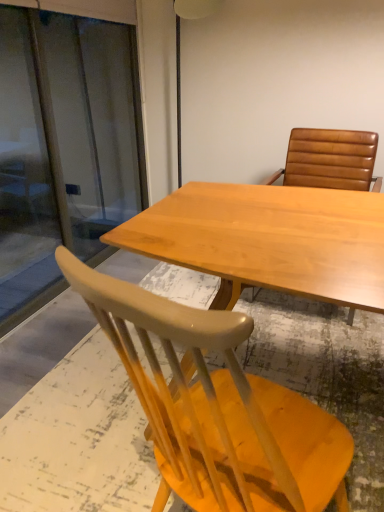
Question: Is brown leather chair at upper right, acting as the 1th chair starting from the top, wider than transparent glass screen door at left?

Choices:
 (A) no
 (B) yes

Answer: (B)

Question: Is brown leather chair at upper right, acting as the 1th chair starting from the top, oriented towards transparent glass screen door at left?

Choices:
 (A) no
 (B) yes

Answer: (A)

Question: From the image's perspective, does brown leather chair at upper right, acting as the 1th chair starting from the top, appear lower than transparent glass screen door at left?

Choices:
 (A) no
 (B) yes

Answer: (B)

Question: From the image's perspective, is brown leather chair at upper right, the second chair from the bottom, over transparent glass screen door at left?

Choices:
 (A) no
 (B) yes

Answer: (A)

Question: Would you say matte yellow chair at lower left, the 2th chair when ordered from top to bottom, is inside or outside transparent glass screen door at left?

Choices:
 (A) outside
 (B) inside

Answer: (A)

Question: Visually, is matte yellow chair at lower left, acting as the first chair starting from the bottom, positioned to the left or to the right of transparent glass screen door at left?

Choices:
 (A) left
 (B) right

Answer: (B)

Question: Is matte yellow chair at lower left, the 2th chair when ordered from top to bottom, wider or thinner than transparent glass screen door at left?

Choices:
 (A) thin
 (B) wide

Answer: (B)

Question: From a real-world perspective, is matte yellow chair at lower left, acting as the first chair starting from the bottom, physically located above or below transparent glass screen door at left?

Choices:
 (A) below
 (B) above

Answer: (A)

Question: Considering the relative positions of brown leather chair at upper right, acting as the 1th chair starting from the top, and transparent glass screen door at left in the image provided, is brown leather chair at upper right, acting as the 1th chair starting from the top, to the left or to the right of transparent glass screen door at left?

Choices:
 (A) right
 (B) left

Answer: (A)

Question: From a real-world perspective, relative to transparent glass screen door at left, is brown leather chair at upper right, acting as the 1th chair starting from the top, vertically above or below?

Choices:
 (A) below
 (B) above

Answer: (A)

Question: Relative to transparent glass screen door at left, is brown leather chair at upper right, the second chair from the bottom, in front or behind?

Choices:
 (A) front
 (B) behind

Answer: (B)

Question: In terms of size, does brown leather chair at upper right, the second chair from the bottom, appear bigger or smaller than transparent glass screen door at left?

Choices:
 (A) small
 (B) big

Answer: (B)

Question: Considering the positions of brown leather chair at upper right, acting as the 1th chair starting from the top, and light wood table at center in the image, is brown leather chair at upper right, acting as the 1th chair starting from the top, taller or shorter than light wood table at center?

Choices:
 (A) tall
 (B) short

Answer: (A)

Question: Is brown leather chair at upper right, acting as the 1th chair starting from the top, bigger or smaller than light wood table at center?

Choices:
 (A) small
 (B) big

Answer: (A)